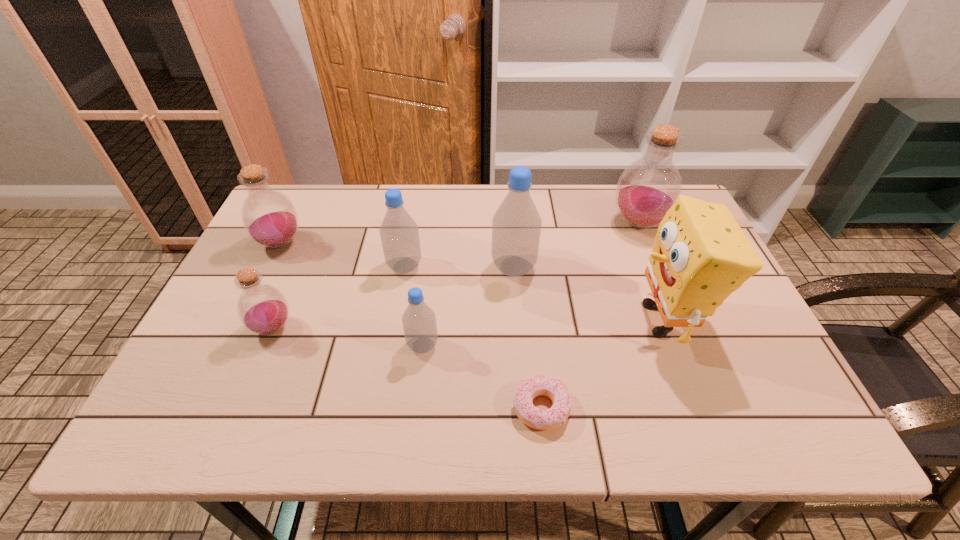
Find the location of a particular element. purple bottle identified as the third closest to the nearest gray bottle is located at coordinates point(648,187).

Identify the location of purple bottle that is the third nearest to the nearest object. (269, 217).

Select which gray bottle appears as the closest to the second smallest purple bottle. Please provide its 2D coordinates. Your answer should be formatted as a tuple, i.e. [(x, y)], where the tuple contains the x and y coordinates of a point satisfying the conditions above.

[(399, 233)]

Identify the location of gray bottle that can be found as the second closest to the second biggest purple bottle. This screenshot has width=960, height=540. (x=419, y=323).

Identify the location of vacant space that satisfies the following two spatial constraints: 1. on the back side of the second biggest gray bottle; 2. on the left side of the biggest purple bottle. The height and width of the screenshot is (540, 960). 412,224.